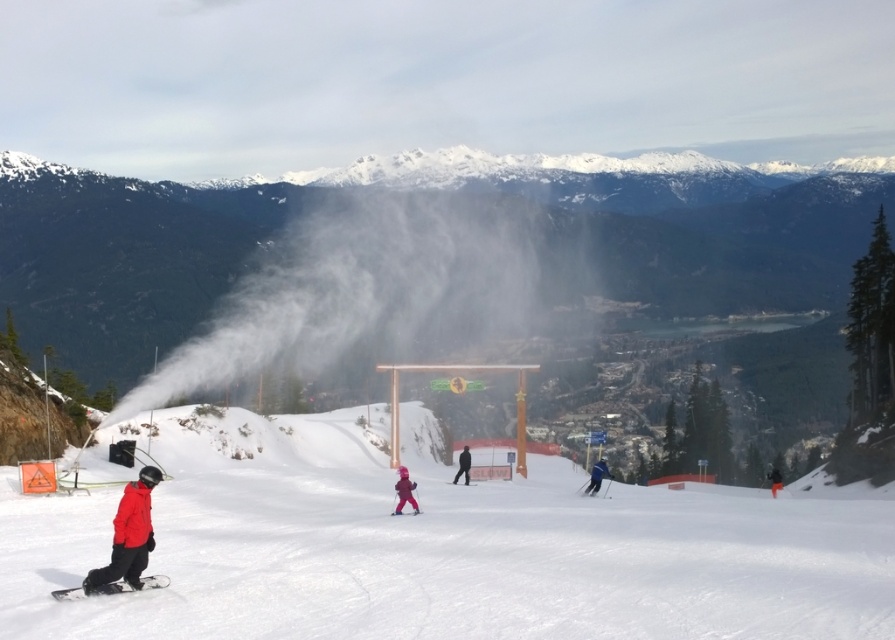
Can you confirm if black matte snowboard at lower left is positioned below matte blue ski at center?

Actually, black matte snowboard at lower left is above matte blue ski at center.

Is black matte snowboard at lower left bigger than matte blue ski at center?

No.

Between point (61, 598) and point (594, 492), which one is positioned behind?

Point (594, 492)

This screenshot has width=895, height=640. I want to click on black matte snowboard at lower left, so click(131, 584).

Can you confirm if white powdery snow at lower left is bigger than matte blue ski at center?

Yes.

Describe the element at coordinates (437, 547) in the screenshot. This screenshot has width=895, height=640. I see `white powdery snow at lower left` at that location.

This screenshot has height=640, width=895. Find the location of `white powdery snow at lower left`. white powdery snow at lower left is located at coordinates (437, 547).

Which is behind, point (160, 582) or point (469, 458)?

Point (469, 458)

Can you confirm if black matte snowboard at lower left is taller than matte pink snowsuit at center?

No, black matte snowboard at lower left is not taller than matte pink snowsuit at center.

Which is in front, point (67, 596) or point (454, 476)?

Point (67, 596)

Find the location of a particular element. black matte snowboard at lower left is located at coordinates (131, 584).